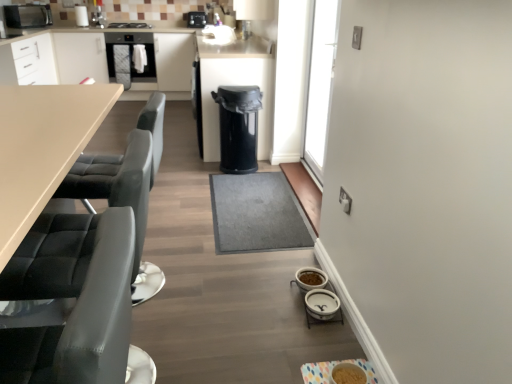
You are a GUI agent. You are given a task and a screenshot of the screen. Output one action in this format:
    pyautogui.click(x=<x>, y=<y>)
    Task: Click on the vacant area that lies between gray carpet at center and black plastic trash can at center, the 5th appliance positioned from the right
    The height and width of the screenshot is (384, 512).
    Given the screenshot: What is the action you would take?
    pyautogui.click(x=260, y=167)